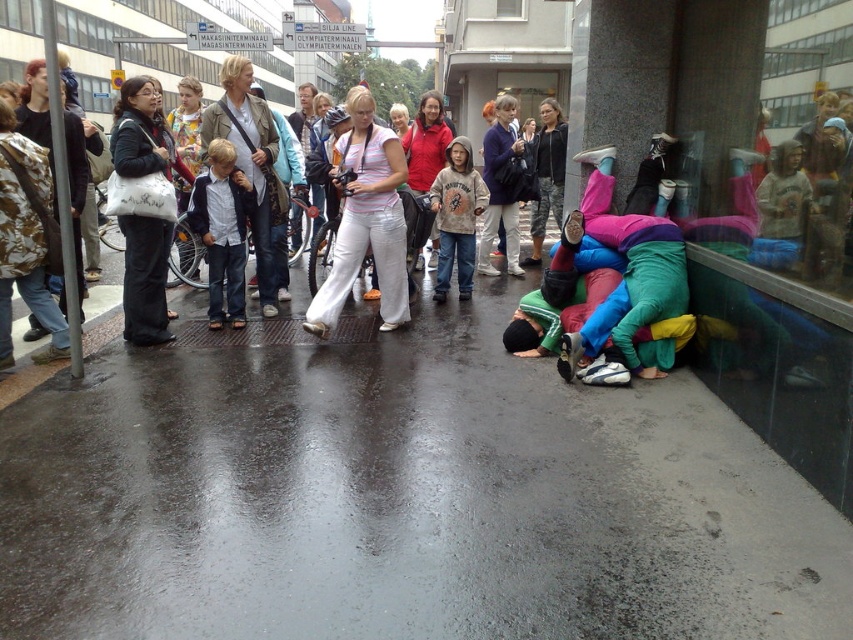
Question: Is wet asphalt pavement at lower center wider than brown cotton hoodie at center?

Choices:
 (A) yes
 (B) no

Answer: (A)

Question: Which point is closer to the camera?

Choices:
 (A) brown cotton hoodie at center
 (B) striped cotton shirt at center
 (C) wet asphalt pavement at lower center

Answer: (C)

Question: Which object is farther from the camera taking this photo?

Choices:
 (A) brown cotton hoodie at center
 (B) wet asphalt pavement at lower center
 (C) denim jeans at center
 (D) striped cotton shirt at center

Answer: (A)

Question: From the image, what is the correct spatial relationship of wet asphalt pavement at lower center in relation to denim jeans at center?

Choices:
 (A) above
 (B) below

Answer: (B)

Question: Which object is farther from the camera taking this photo?

Choices:
 (A) denim jeans at center
 (B) matte black bag at left

Answer: (A)

Question: Can you confirm if matte black bag at left is positioned to the left of brown cotton hoodie at center?

Choices:
 (A) no
 (B) yes

Answer: (B)